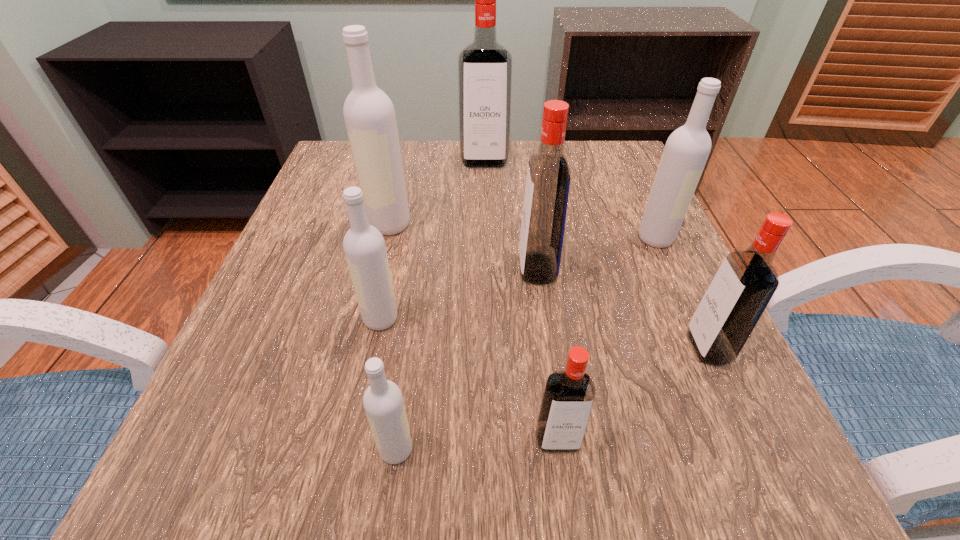
Where is `blank area at the far left corner`? blank area at the far left corner is located at coordinates (343, 178).

At what (x,y) coordinates should I click in order to perform the action: click on vacant space at the far right corner of the desktop. Please return your answer as a coordinate pair (x, y). Looking at the image, I should click on (572, 155).

Find the location of a particular element. This screenshot has width=960, height=540. vacant point located between the rightmost red vodka and the farthest vodka is located at coordinates (596, 254).

The image size is (960, 540). Identify the location of free spot between the smallest white vodka and the biggest white vodka. (393, 336).

Where is `unoccupied position between the fifth nearest vodka and the second smallest white vodka`? unoccupied position between the fifth nearest vodka and the second smallest white vodka is located at coordinates (459, 294).

Image resolution: width=960 pixels, height=540 pixels. In order to click on empty location between the third biggest red vodka and the leftmost red vodka in this screenshot , I will do `click(596, 254)`.

The height and width of the screenshot is (540, 960). I want to click on empty location between the sixth object from right to left and the farthest red vodka, so (x=441, y=306).

You are a GUI agent. You are given a task and a screenshot of the screen. Output one action in this format:
    pyautogui.click(x=<x>, y=<y>)
    Task: Click on the vacant space in between the rightmost white vodka and the third nearest red vodka
    
    Given the screenshot: What is the action you would take?
    pyautogui.click(x=596, y=253)

You are a GUI agent. You are given a task and a screenshot of the screen. Output one action in this format:
    pyautogui.click(x=<x>, y=<y>)
    Task: Click on the vacant space that is in between the rightmost white vodka and the smallest red vodka
    The height and width of the screenshot is (540, 960).
    Given the screenshot: What is the action you would take?
    pyautogui.click(x=607, y=339)

At what (x,y) coordinates should I click in order to perform the action: click on empty space between the second biggest white vodka and the third farthest red vodka. Please return your answer as a coordinate pair (x, y). Looking at the image, I should click on (682, 293).